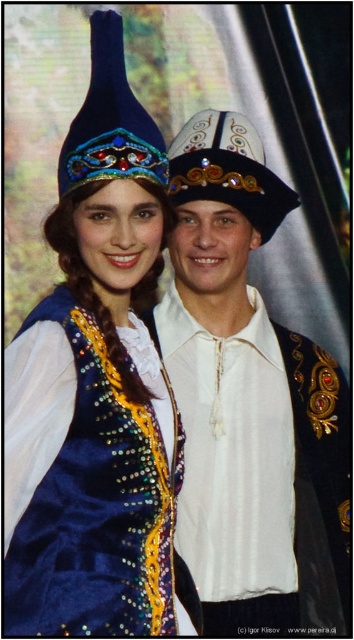
Question: Among these points, which one is nearest to the camera?

Choices:
 (A) (118, 168)
 (B) (276, 381)

Answer: (A)

Question: Is velvet blue dress at center wider than white satin shirt at center?

Choices:
 (A) yes
 (B) no

Answer: (B)

Question: Is velvet blue dress at center bigger than white satin shirt at center?

Choices:
 (A) yes
 (B) no

Answer: (B)

Question: From the image, what is the correct spatial relationship of velvet blue dress at center in relation to white satin shirt at center?

Choices:
 (A) right
 (B) left

Answer: (B)

Question: Which object is closer to the camera taking this photo?

Choices:
 (A) velvet blue dress at center
 (B) white satin shirt at center

Answer: (A)